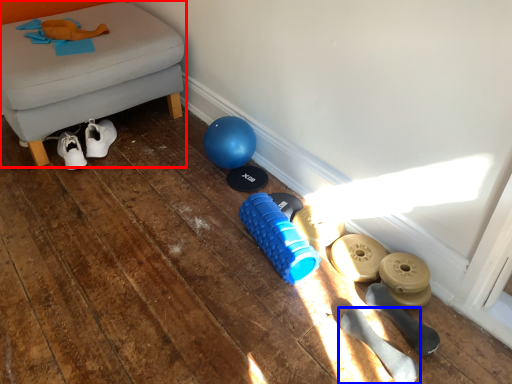
Question: Which point is closer to the camera, furniture (highlighted by a red box) or footwear (highlighted by a blue box)?

Choices:
 (A) furniture
 (B) footwear

Answer: (B)